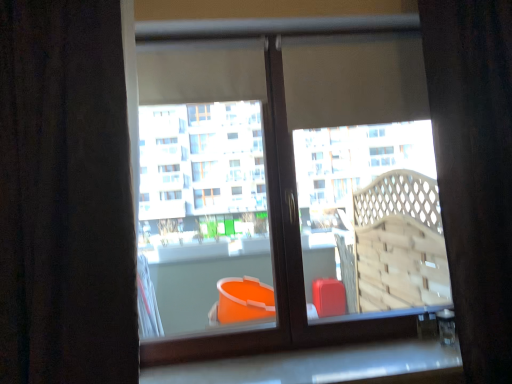
Locate an element on the screen. The height and width of the screenshot is (384, 512). brown textured curtain at left, arranged as the 2th curtain when viewed from the right is located at coordinates (65, 197).

Identify the location of velvet dark brown curtain at right, which is counted as the first curtain, starting from the right. Image resolution: width=512 pixels, height=384 pixels. (474, 170).

Is brown textured curtain at left, placed as the first curtain when sorted from left to right, smaller than velvet dark brown curtain at right, which is counted as the first curtain, starting from the right?

Indeed, brown textured curtain at left, placed as the first curtain when sorted from left to right, has a smaller size compared to velvet dark brown curtain at right, which is counted as the first curtain, starting from the right.

Is brown textured curtain at left, placed as the first curtain when sorted from left to right, touching velvet dark brown curtain at right, which is counted as the first curtain, starting from the right?

No.

Is brown textured curtain at left, arranged as the 2th curtain when viewed from the right, in front of or behind velvet dark brown curtain at right, which is counted as the first curtain, starting from the right, in the image?

Clearly, brown textured curtain at left, arranged as the 2th curtain when viewed from the right, is in front of velvet dark brown curtain at right, which is counted as the first curtain, starting from the right.

Do you think velvet dark brown curtain at right, which is counted as the first curtain, starting from the right, is within matte plastic bucket at center, or outside of it?

velvet dark brown curtain at right, which is counted as the first curtain, starting from the right, is not inside matte plastic bucket at center, it's outside.

Based on the photo, can you confirm if velvet dark brown curtain at right, arranged as the second curtain when viewed from the left, is taller than matte plastic bucket at center?

Indeed, velvet dark brown curtain at right, arranged as the second curtain when viewed from the left, has a greater height compared to matte plastic bucket at center.

Between velvet dark brown curtain at right, which is counted as the first curtain, starting from the right, and matte plastic bucket at center, which one is positioned in front?

velvet dark brown curtain at right, which is counted as the first curtain, starting from the right, is closer to the camera.

Is velvet dark brown curtain at right, which is counted as the first curtain, starting from the right, to the right of matte plastic bucket at center from the viewer's perspective?

Yes.

Considering the positions of point (341, 178) and point (504, 29), is point (341, 178) closer or farther from the camera than point (504, 29)?

Point (341, 178).

From a real-world perspective, is matte plastic bucket at center positioned over velvet dark brown curtain at right, which is counted as the first curtain, starting from the right, based on gravity?

Yes, from a real-world perspective, matte plastic bucket at center is over velvet dark brown curtain at right, which is counted as the first curtain, starting from the right

Is matte plastic bucket at center oriented towards velvet dark brown curtain at right, arranged as the second curtain when viewed from the left?

Yes, matte plastic bucket at center is aimed at velvet dark brown curtain at right, arranged as the second curtain when viewed from the left.

Consider the image. Who is more distant, matte plastic bucket at center or velvet dark brown curtain at right, arranged as the second curtain when viewed from the left?

matte plastic bucket at center is more distant.

Which is less distant, (160, 158) or (374, 358)?

Clearly, point (160, 158) is more distant from the camera than point (374, 358).

Considering their positions, is matte plastic bucket at center located in front of or behind white marble window sill at lower center?

A: Clearly, matte plastic bucket at center is behind white marble window sill at lower center.

Between matte plastic bucket at center and white marble window sill at lower center, which one has more height?

With more height is matte plastic bucket at center.

Is matte plastic bucket at center looking in the opposite direction of white marble window sill at lower center?

No, white marble window sill at lower center is not at the back of matte plastic bucket at center.

From the image's perspective, which one is positioned higher, velvet dark brown curtain at right, which is counted as the first curtain, starting from the right, or white marble window sill at lower center?

velvet dark brown curtain at right, which is counted as the first curtain, starting from the right, is shown above in the image.

Does velvet dark brown curtain at right, arranged as the second curtain when viewed from the left, have a lesser height compared to white marble window sill at lower center?

Incorrect, the height of velvet dark brown curtain at right, arranged as the second curtain when viewed from the left, does not fall short of that of white marble window sill at lower center.

Considering the sizes of objects velvet dark brown curtain at right, which is counted as the first curtain, starting from the right, and white marble window sill at lower center in the image provided, who is wider, velvet dark brown curtain at right, which is counted as the first curtain, starting from the right, or white marble window sill at lower center?

With larger width is velvet dark brown curtain at right, which is counted as the first curtain, starting from the right.

Is point (472, 195) farther from camera compared to point (187, 378)?

No, (472, 195) is in front of (187, 378).

Is matte plastic bucket at center in contact with brown textured curtain at left, arranged as the 2th curtain when viewed from the right?

No, matte plastic bucket at center is not next to brown textured curtain at left, arranged as the 2th curtain when viewed from the right.

Is matte plastic bucket at center outside of brown textured curtain at left, placed as the first curtain when sorted from left to right?

That's correct, matte plastic bucket at center is outside of brown textured curtain at left, placed as the first curtain when sorted from left to right.

Can you confirm if matte plastic bucket at center is taller than brown textured curtain at left, placed as the first curtain when sorted from left to right?

No, matte plastic bucket at center is not taller than brown textured curtain at left, placed as the first curtain when sorted from left to right.

Can you tell me how much matte plastic bucket at center and brown textured curtain at left, arranged as the 2th curtain when viewed from the right, differ in facing direction?

matte plastic bucket at center and brown textured curtain at left, arranged as the 2th curtain when viewed from the right, are facing 0.614 degrees away from each other.

Which is in front, white marble window sill at lower center or brown textured curtain at left, placed as the first curtain when sorted from left to right?

Positioned in front is brown textured curtain at left, placed as the first curtain when sorted from left to right.

Locate an element on the screen. The height and width of the screenshot is (384, 512). curtain that is the 2nd object located in front of the white marble window sill at lower center is located at coordinates (65, 197).

Considering the sizes of objects white marble window sill at lower center and brown textured curtain at left, arranged as the 2th curtain when viewed from the right, in the image provided, who is shorter, white marble window sill at lower center or brown textured curtain at left, arranged as the 2th curtain when viewed from the right,?

Standing shorter between the two is white marble window sill at lower center.

Does white marble window sill at lower center appear on the left side of brown textured curtain at left, placed as the first curtain when sorted from left to right?

Incorrect, white marble window sill at lower center is not on the left side of brown textured curtain at left, placed as the first curtain when sorted from left to right.

The image size is (512, 384). I want to click on curtain located in front of the velvet dark brown curtain at right, which is counted as the first curtain, starting from the right, so point(65,197).

Locate an element on the screen. Image resolution: width=512 pixels, height=384 pixels. bay window that appears on the left of velvet dark brown curtain at right, which is counted as the first curtain, starting from the right is located at coordinates (373, 215).

When comparing their distances from brown textured curtain at left, placed as the first curtain when sorted from left to right, does white marble window sill at lower center or velvet dark brown curtain at right, arranged as the second curtain when viewed from the left, seem closer?

Based on the image, white marble window sill at lower center appears to be nearer to brown textured curtain at left, placed as the first curtain when sorted from left to right.

When comparing their distances from velvet dark brown curtain at right, which is counted as the first curtain, starting from the right, does white marble window sill at lower center or matte plastic bucket at center seem further?

Based on the image, matte plastic bucket at center appears to be further to velvet dark brown curtain at right, which is counted as the first curtain, starting from the right.

Which object lies nearer to the anchor point brown textured curtain at left, placed as the first curtain when sorted from left to right, velvet dark brown curtain at right, which is counted as the first curtain, starting from the right, or white marble window sill at lower center?

white marble window sill at lower center.

From the picture: Based on their spatial positions, is matte plastic bucket at center or brown textured curtain at left, arranged as the 2th curtain when viewed from the right, further from velvet dark brown curtain at right, which is counted as the first curtain, starting from the right?

Among the two, brown textured curtain at left, arranged as the 2th curtain when viewed from the right, is located further to velvet dark brown curtain at right, which is counted as the first curtain, starting from the right.

Considering their positions, is matte plastic bucket at center positioned closer to velvet dark brown curtain at right, which is counted as the first curtain, starting from the right, than white marble window sill at lower center?

white marble window sill at lower center lies closer to velvet dark brown curtain at right, which is counted as the first curtain, starting from the right, than the other object.

Based on their spatial positions, is velvet dark brown curtain at right, arranged as the second curtain when viewed from the left, or white marble window sill at lower center closer to matte plastic bucket at center?

white marble window sill at lower center lies closer to matte plastic bucket at center than the other object.

Based on the photo, estimate the real-world distances between objects in this image. Which object is closer to brown textured curtain at left, arranged as the 2th curtain when viewed from the right, velvet dark brown curtain at right, arranged as the second curtain when viewed from the left, or matte plastic bucket at center?

velvet dark brown curtain at right, arranged as the second curtain when viewed from the left.

From the image, which object appears to be farther from matte plastic bucket at center, white marble window sill at lower center or brown textured curtain at left, arranged as the 2th curtain when viewed from the right?

The object further to matte plastic bucket at center is brown textured curtain at left, arranged as the 2th curtain when viewed from the right.

Where is `bay window between brown textured curtain at left, placed as the first curtain when sorted from left to right, and white marble window sill at lower center`? bay window between brown textured curtain at left, placed as the first curtain when sorted from left to right, and white marble window sill at lower center is located at coordinates (373, 215).

Where is `bay window between brown textured curtain at left, placed as the first curtain when sorted from left to right, and velvet dark brown curtain at right, which is counted as the first curtain, starting from the right`? The width and height of the screenshot is (512, 384). bay window between brown textured curtain at left, placed as the first curtain when sorted from left to right, and velvet dark brown curtain at right, which is counted as the first curtain, starting from the right is located at coordinates (373, 215).

The width and height of the screenshot is (512, 384). I want to click on bay window between velvet dark brown curtain at right, which is counted as the first curtain, starting from the right, and white marble window sill at lower center, in the vertical direction, so coord(373,215).

This screenshot has width=512, height=384. I want to click on window sill between brown textured curtain at left, placed as the first curtain when sorted from left to right, and velvet dark brown curtain at right, arranged as the second curtain when viewed from the left, in the horizontal direction, so click(325, 366).